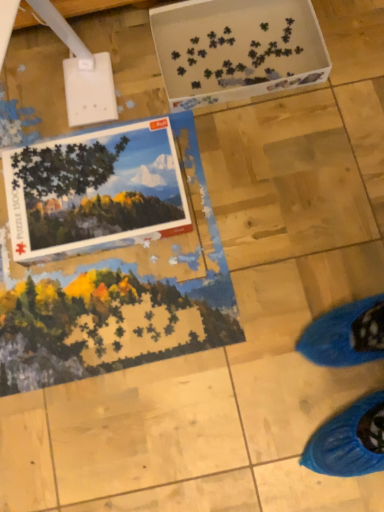
Question: Is white plastic puzzle pieces at upper center smaller than matte cardboard puzzle box at upper left?

Choices:
 (A) no
 (B) yes

Answer: (A)

Question: Does white plastic puzzle pieces at upper center have a greater width compared to matte cardboard puzzle box at upper left?

Choices:
 (A) no
 (B) yes

Answer: (B)

Question: Is white plastic puzzle pieces at upper center not within matte cardboard puzzle box at upper left?

Choices:
 (A) yes
 (B) no

Answer: (A)

Question: Could you tell me if white plastic puzzle pieces at upper center is facing matte cardboard puzzle box at upper left?

Choices:
 (A) no
 (B) yes

Answer: (A)

Question: Would you say white plastic puzzle pieces at upper center contains matte cardboard puzzle box at upper left?

Choices:
 (A) yes
 (B) no

Answer: (B)

Question: Considering the relative sizes of white plastic puzzle pieces at upper center and matte cardboard puzzle box at upper left in the image provided, is white plastic puzzle pieces at upper center thinner than matte cardboard puzzle box at upper left?

Choices:
 (A) no
 (B) yes

Answer: (A)

Question: Is white plastic puzzle pieces at upper center inside matte cardboard puzzle box at upper left?

Choices:
 (A) no
 (B) yes

Answer: (A)

Question: Does matte cardboard puzzle box at upper left appear on the left side of white plastic puzzle pieces at upper center?

Choices:
 (A) no
 (B) yes

Answer: (B)

Question: Considering the relative sizes of matte cardboard puzzle box at upper left and white plastic puzzle pieces at upper center in the image provided, is matte cardboard puzzle box at upper left bigger than white plastic puzzle pieces at upper center?

Choices:
 (A) yes
 (B) no

Answer: (B)

Question: Is matte cardboard puzzle box at upper left oriented towards white plastic puzzle pieces at upper center?

Choices:
 (A) no
 (B) yes

Answer: (A)

Question: Can you confirm if matte cardboard puzzle box at upper left is taller than white plastic puzzle pieces at upper center?

Choices:
 (A) no
 (B) yes

Answer: (A)

Question: From the image's perspective, is matte cardboard puzzle box at upper left located beneath white plastic puzzle pieces at upper center?

Choices:
 (A) no
 (B) yes

Answer: (B)

Question: Would you say white plastic puzzle pieces at upper center is inside or outside matte cardboard puzzle box at upper left?

Choices:
 (A) outside
 (B) inside

Answer: (A)